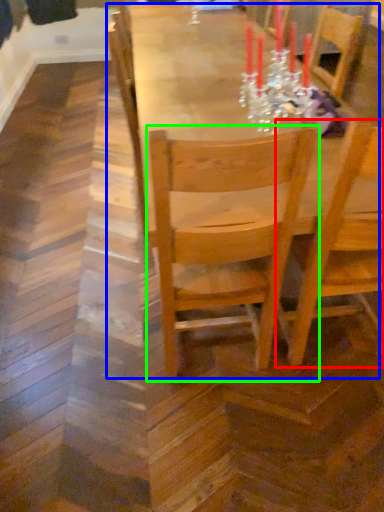
Question: Which object is positioned closest to chair (highlighted by a red box)? Select from table (highlighted by a blue box) and chair (highlighted by a green box).

Choices:
 (A) table
 (B) chair

Answer: (B)